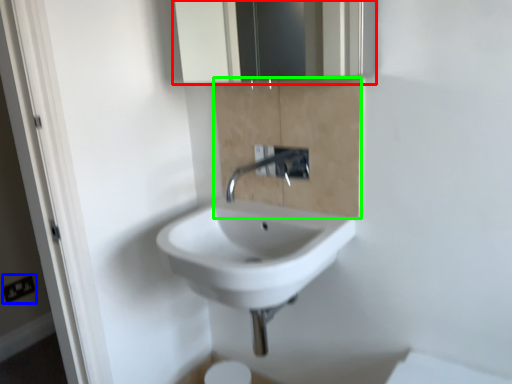
Question: Which is nearer to the medicine cabinet (highlighted by a red box)? electric outlet (highlighted by a blue box) or cabinetry (highlighted by a green box).

Choices:
 (A) electric outlet
 (B) cabinetry

Answer: (B)